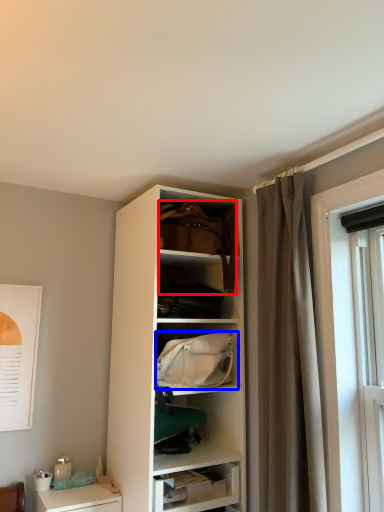
Question: Which object appears farthest to the camera in this image, handbag (highlighted by a red box) or handbag (highlighted by a blue box)?

Choices:
 (A) handbag
 (B) handbag

Answer: (A)